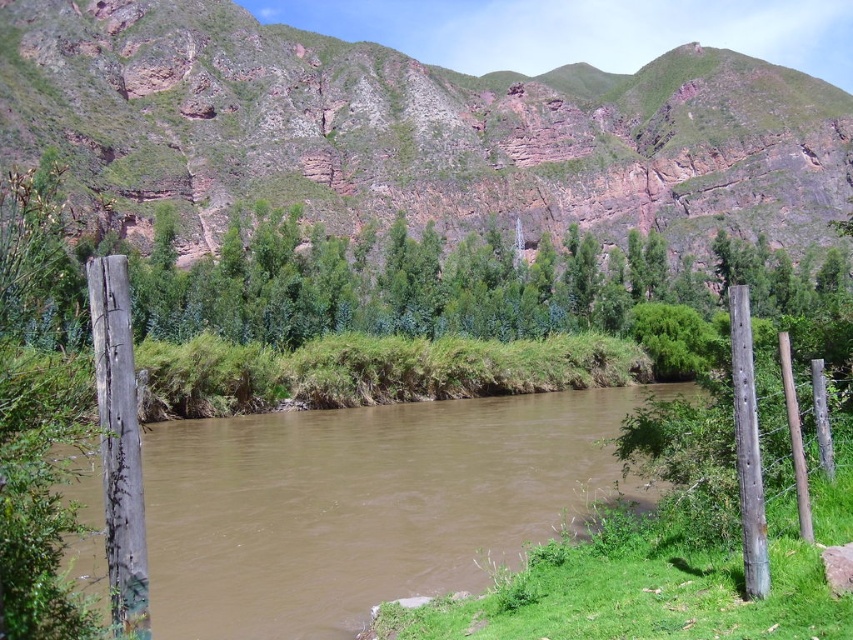
You are standing at the edge of the river and want to walk towards the rustic rock cliff at center and the gray weathered wood post at right. Which object will you reach first?

You will reach the gray weathered wood post at right first because it is closer to you than the rustic rock cliff at center, which is further away.

Consider the image. You are a hiker who wants to cross the river using the wooden post. Based on the scene, can you determine if the brown muddy water at center is deeper than the gray weathered wood post at right?

The brown muddy water at center is not as tall as the gray weathered wood post at right, meaning the water is shallower than the post. Therefore, the water is not deeper than the post, so the post is still above water and can be used for crossing.

You are standing at the point with coordinates point (738, 328) and want to walk towards the point with coordinates point (724, 188). Will you be moving towards the river or away from it?

Since point (724, 188) is behind point (738, 328), moving towards it would mean walking away from the river.